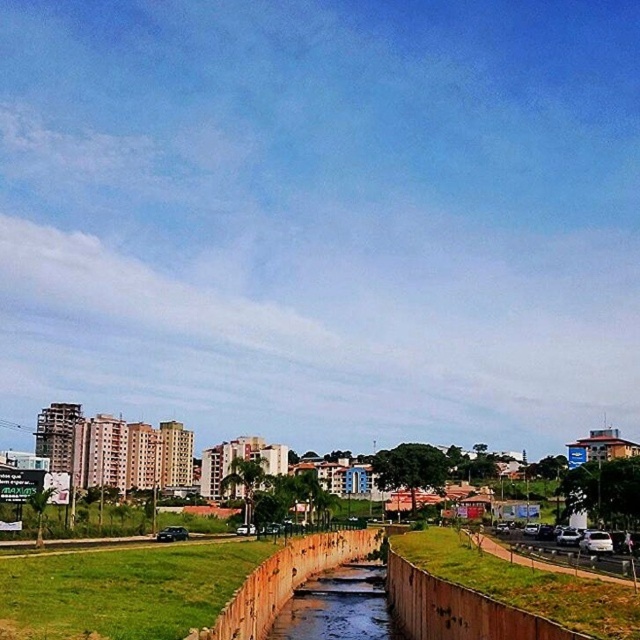
In the scene shown: Is green grass at lower left positioned in front of brown concrete river at center?

That is True.

Consider the image. Which is more to the right, green grass at lower left or brown concrete river at center?

From the viewer's perspective, brown concrete river at center appears more on the right side.

Between point (84, 568) and point (376, 600), which one is positioned in front?

Point (84, 568) is in front.

This screenshot has height=640, width=640. I want to click on green grass at lower left, so click(122, 589).

Does green grass at lower left have a greater width compared to green grass at lower center?

Indeed, green grass at lower left has a greater width compared to green grass at lower center.

Which is above, green grass at lower left or green grass at lower center?

green grass at lower left is higher up.

Between point (193, 602) and point (472, 576), which one is positioned in front?

Point (193, 602) is in front.

Find the location of a particular element. green grass at lower left is located at coordinates (122, 589).

Does green grass at lower center have a smaller size compared to brown concrete river at center?

Incorrect, green grass at lower center is not smaller in size than brown concrete river at center.

Which is above, green grass at lower center or brown concrete river at center?

green grass at lower center is above.

Identify the location of green grass at lower center. Image resolution: width=640 pixels, height=640 pixels. (525, 584).